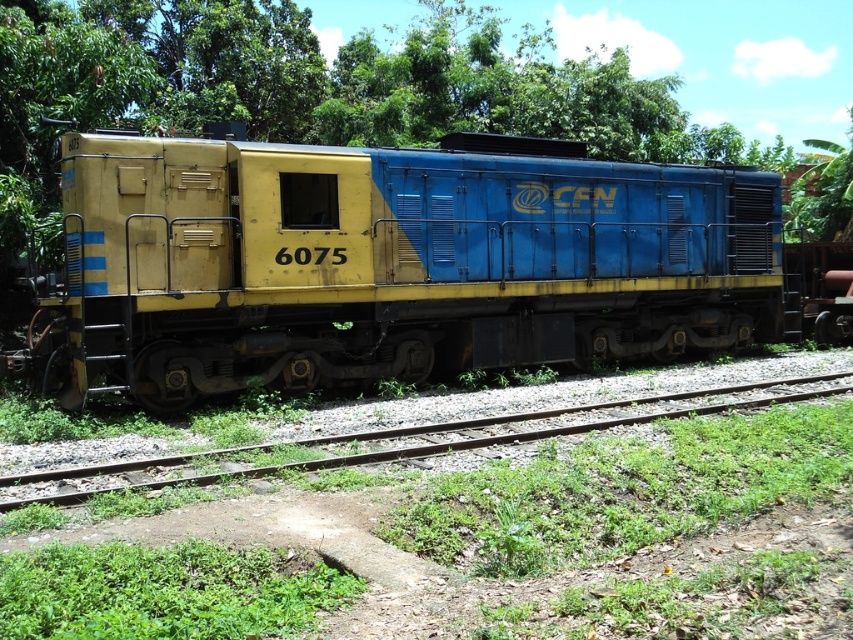
In the scene shown: You are a railway engineer inspecting the tracks. You notice the yellow matte train at center and the gravel track at center. Based on the scene, which object is wider?

The yellow matte train at center is wider than the gravel track at center according to the description.

You are a railway inspector checking the alignment of the tracks. You notice the yellow matte train at center and the gravel track at center. Which object is closer to the left edge of the image?

The yellow matte train at center is positioned on the left side of gravel track at center, so it is closer to the left edge of the image.